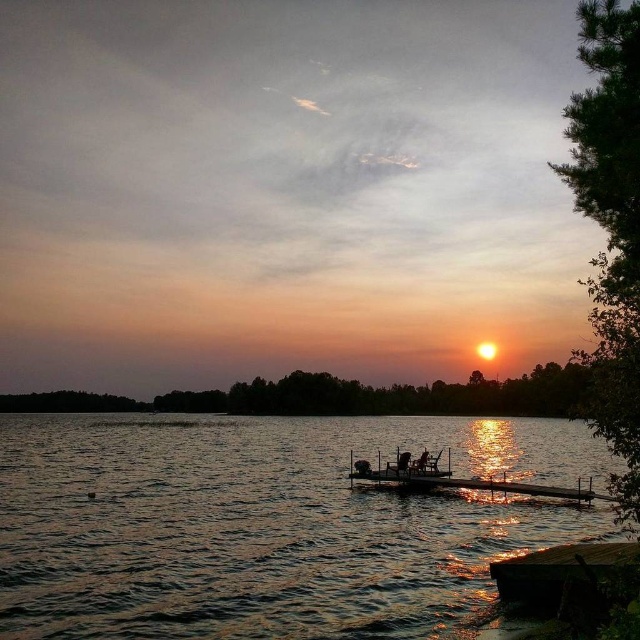
Question: Can you confirm if glistening water at center is thinner than wooden dock at lower right?

Choices:
 (A) yes
 (B) no

Answer: (B)

Question: Where is glistening water at center located in relation to wooden dock at lower right in the image?

Choices:
 (A) above
 (B) below

Answer: (B)

Question: In this image, where is glistening water at center located relative to wooden dock at lower right?

Choices:
 (A) right
 (B) left

Answer: (B)